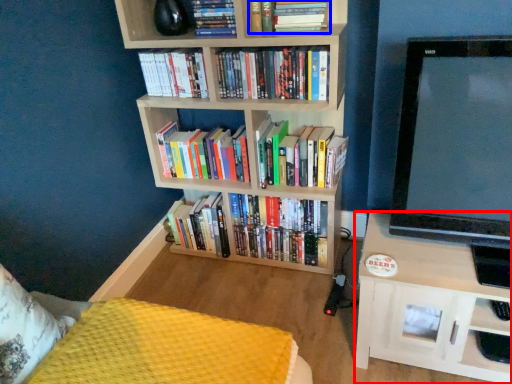
Question: Among these objects, which one is nearest to the camera, shelf (highlighted by a red box) or book (highlighted by a blue box)?

Choices:
 (A) shelf
 (B) book

Answer: (A)